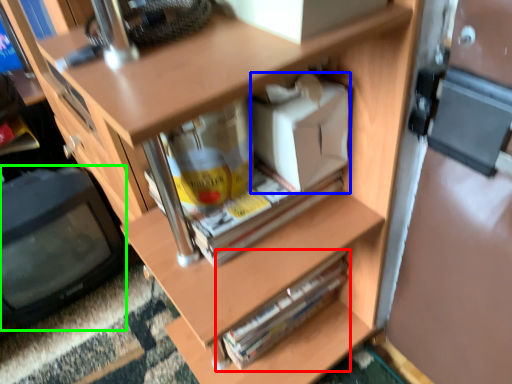
Question: Based on their relative distances, which object is farther from paperback book (highlighted by a red box)? Choose from box (highlighted by a blue box) and computer monitor (highlighted by a green box).

Choices:
 (A) box
 (B) computer monitor

Answer: (B)